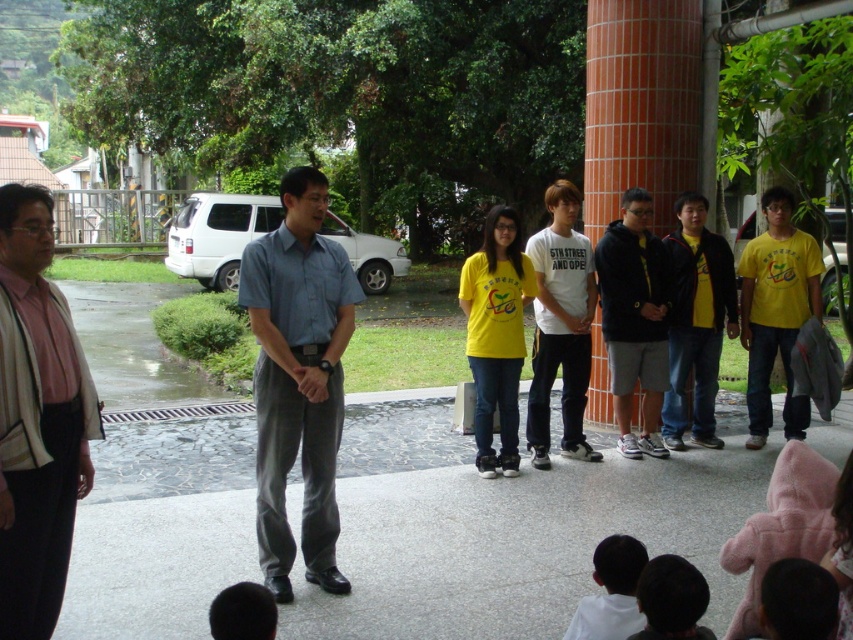
Question: Based on their relative distances, which object is nearer to the smooth black hair at lower center?

Choices:
 (A) yellow matte jacket at center
 (B) orange brick pillar at center
 (C) white matte shirt at lower center

Answer: (C)

Question: Can you confirm if white matte t-shirt at center is positioned to the right of yellow matte shirt at center?

Choices:
 (A) yes
 (B) no

Answer: (A)

Question: Does orange brick pillar at center appear over black hoodie at center?

Choices:
 (A) no
 (B) yes

Answer: (B)

Question: Among these points, which one is farthest from the camera?

Choices:
 (A) (685, 172)
 (B) (44, 328)

Answer: (A)

Question: Is white matte t-shirt at center wider than white matte shirt at lower center?

Choices:
 (A) no
 (B) yes

Answer: (B)

Question: Which point is closer to the camera?

Choices:
 (A) light blue fabric shirt at center
 (B) yellow matte jacket at center
 (C) white matte t-shirt at center
 (D) black hoodie at center

Answer: (A)